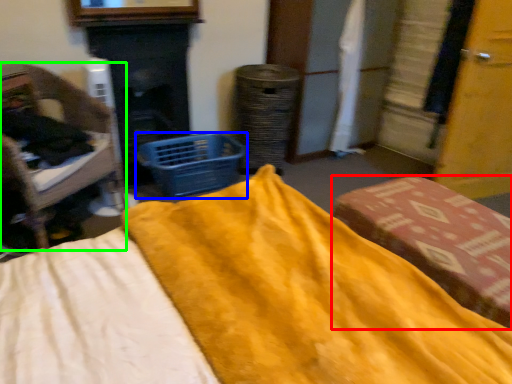
Question: Estimate the real-world distances between objects in this image. Which object is farther from furniture (highlighted by a red box), basket (highlighted by a blue box) or furniture (highlighted by a green box)?

Choices:
 (A) basket
 (B) furniture

Answer: (B)